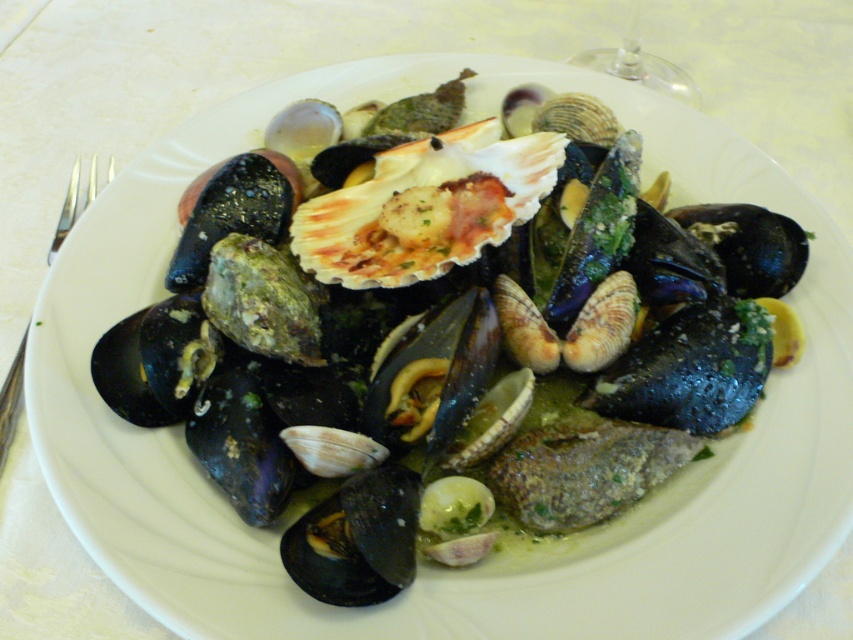
Question: Which point is closer to the camera?

Choices:
 (A) 9,401
 (B) 668,93

Answer: (A)

Question: Does transparent glass at upper right have a larger size compared to silver metallic fork at left?

Choices:
 (A) yes
 (B) no

Answer: (B)

Question: Does transparent glass at upper right appear on the left side of silver metallic fork at left?

Choices:
 (A) yes
 (B) no

Answer: (B)

Question: Considering the relative positions of transparent glass at upper right and silver metallic fork at left in the image provided, where is transparent glass at upper right located with respect to silver metallic fork at left?

Choices:
 (A) above
 (B) below

Answer: (A)

Question: Which point is farther to the camera?

Choices:
 (A) (641, 58)
 (B) (71, 177)

Answer: (A)